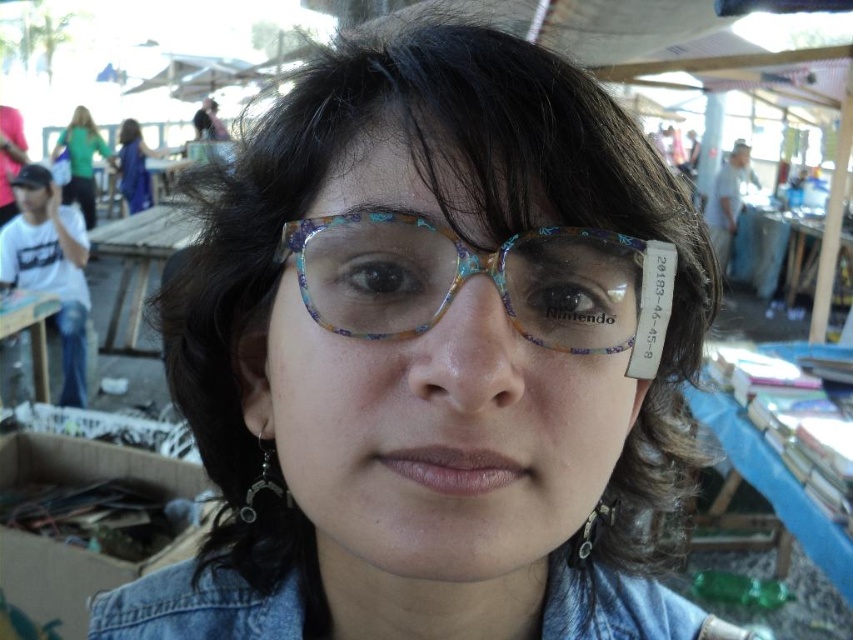
Question: Which of these objects is positioned closest to the green fabric shirt at upper left?

Choices:
 (A) dark brown glossy hair at center
 (B) matte blue shirt at upper left
 (C) white t-shirt at left
 (D) translucent plastic glasses at center

Answer: (B)

Question: Which of the following is the closest to the observer?

Choices:
 (A) (30, 188)
 (B) (741, 173)

Answer: (A)

Question: Which point is farther from the camera taking this photo?

Choices:
 (A) (91, 132)
 (B) (529, 269)
 (C) (718, 198)
 (D) (148, 637)

Answer: (C)

Question: Does translucent plastic glasses at center have a smaller size compared to white t-shirt at left?

Choices:
 (A) no
 (B) yes

Answer: (B)

Question: Does faded denim jacket at lower right appear under matte blue shirt at upper left?

Choices:
 (A) yes
 (B) no

Answer: (A)

Question: Does dark brown glossy hair at center have a smaller size compared to matte blue shirt at upper left?

Choices:
 (A) no
 (B) yes

Answer: (B)